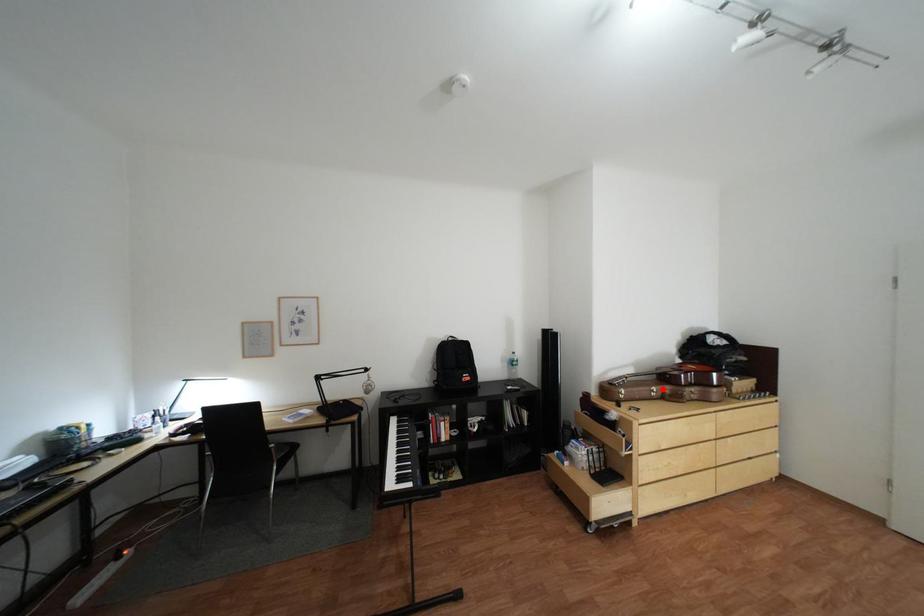
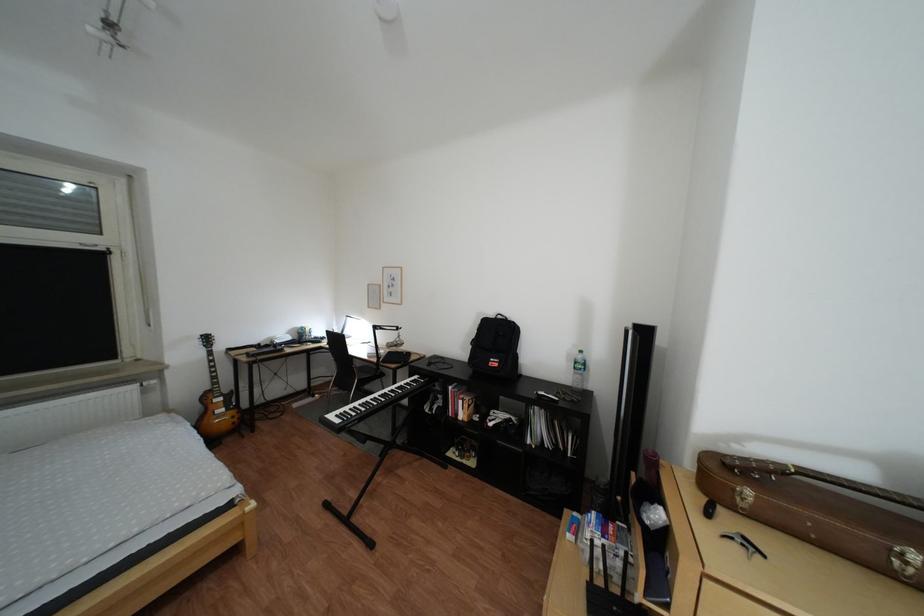
The point at the highlighted location is marked in the first image. Where is the corresponding point in the second image?

(885, 537)